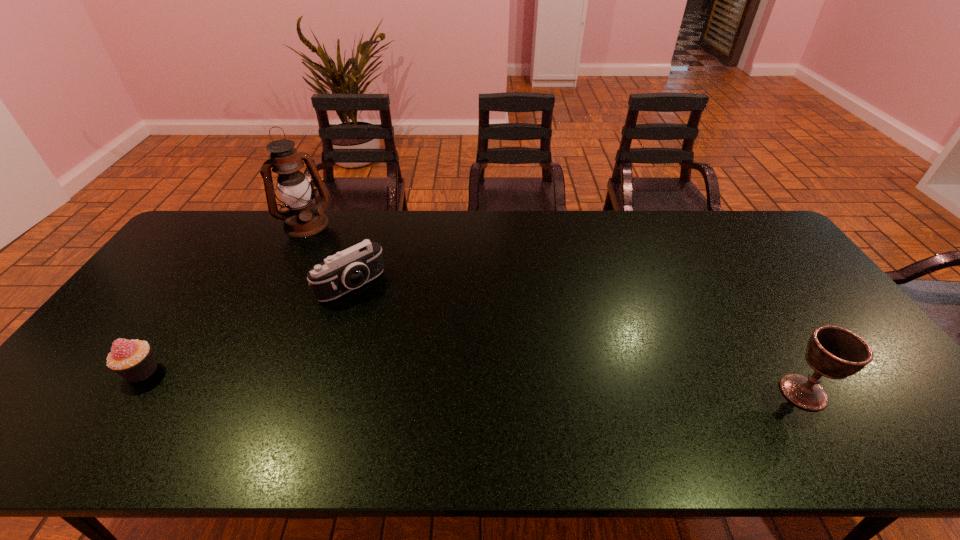
Find the location of a particular element. the shortest object is located at coordinates click(x=132, y=359).

You are a GUI agent. You are given a task and a screenshot of the screen. Output one action in this format:
    pyautogui.click(x=<x>, y=<y>)
    Task: Click on the leftmost object
    This screenshot has width=960, height=540.
    Given the screenshot: What is the action you would take?
    pyautogui.click(x=132, y=359)

You are a GUI agent. You are given a task and a screenshot of the screen. Output one action in this format:
    pyautogui.click(x=<x>, y=<y>)
    Task: Click on the chalice
    Image resolution: width=960 pixels, height=540 pixels.
    Given the screenshot: What is the action you would take?
    pyautogui.click(x=834, y=352)

This screenshot has height=540, width=960. In order to click on the third shortest object in this screenshot , I will do `click(834, 352)`.

Locate an element on the screen. This screenshot has width=960, height=540. the third nearest object is located at coordinates (338, 274).

You are a GUI agent. You are given a task and a screenshot of the screen. Output one action in this format:
    pyautogui.click(x=<x>, y=<y>)
    Task: Click on the second object from right to left
    This screenshot has width=960, height=540.
    Given the screenshot: What is the action you would take?
    pyautogui.click(x=338, y=274)

At what (x,y) coordinates should I click in order to perform the action: click on lantern. Please return your answer as a coordinate pair (x, y). Looking at the image, I should click on (302, 219).

This screenshot has height=540, width=960. I want to click on the third object from right to left, so click(x=302, y=219).

You are a GUI agent. You are given a task and a screenshot of the screen. Output one action in this format:
    pyautogui.click(x=<x>, y=<y>)
    Task: Click on the vacant space located on the back of the shortest object
    
    Given the screenshot: What is the action you would take?
    pyautogui.click(x=208, y=274)

This screenshot has height=540, width=960. I want to click on vacant area situated on the left of the chalice, so click(x=759, y=392).